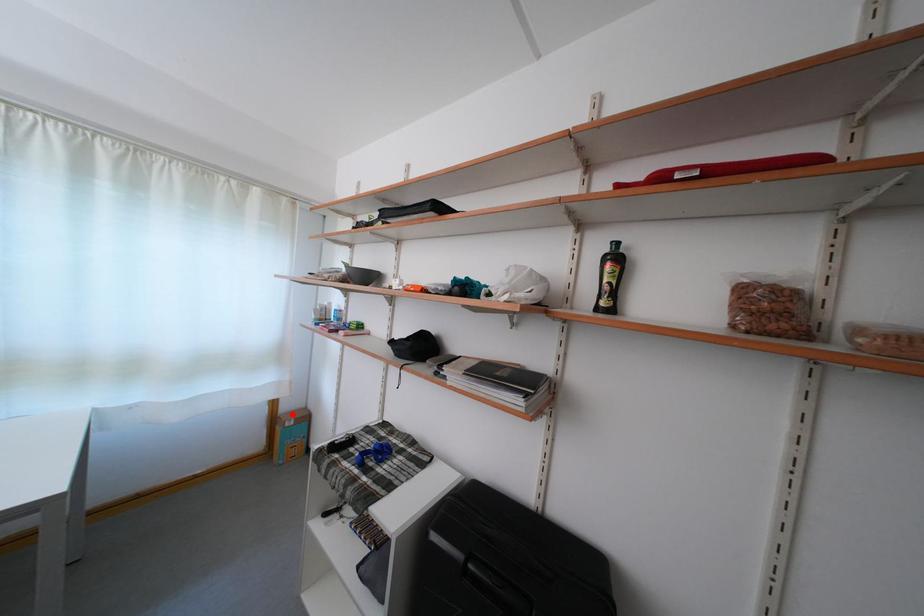
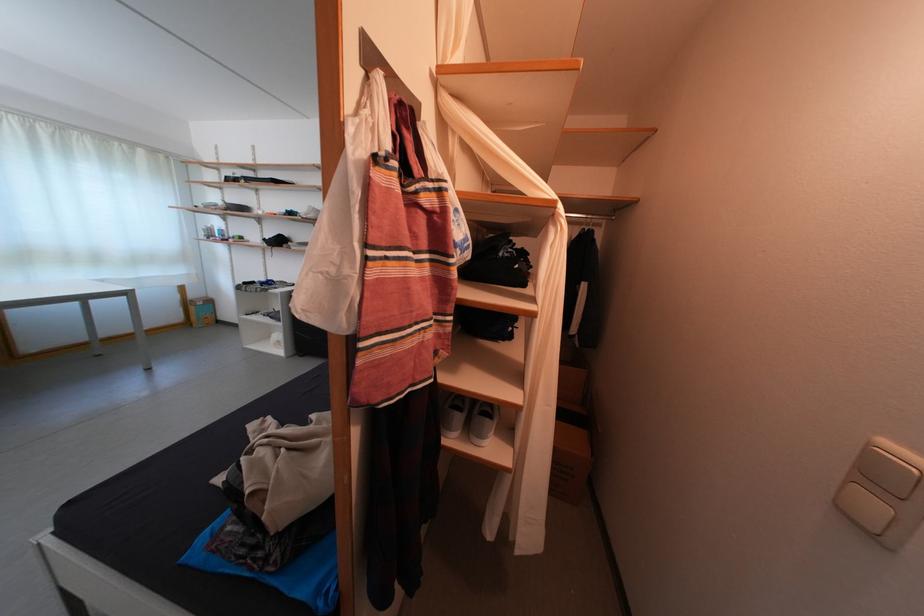
Question: I am providing you with two images of the same scene from different viewpoints. A red point is shown in image1. For the corresponding object point in image2, is it positioned nearer or farther from the camera?

Choices:
 (A) Nearer
 (B) Farther

Answer: (A)